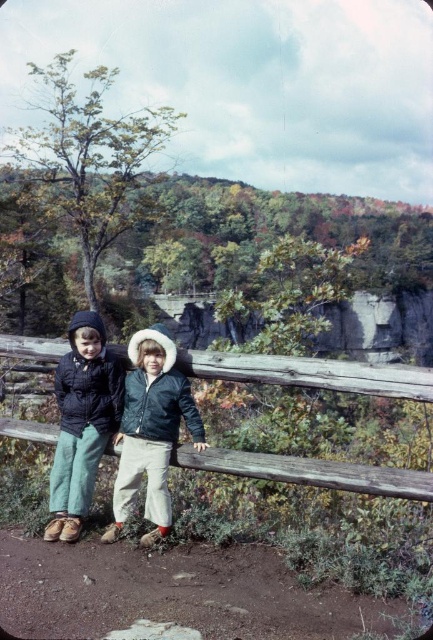
Question: Which of these objects is positioned farthest from the wooden fence at center?

Choices:
 (A) matte black jacket at left
 (B) velvet blue jacket at center

Answer: (A)

Question: Considering the relative positions of wooden fence at center and velvet blue jacket at center in the image provided, where is wooden fence at center located with respect to velvet blue jacket at center?

Choices:
 (A) below
 (B) above

Answer: (B)

Question: Does velvet blue jacket at center have a smaller size compared to matte black jacket at left?

Choices:
 (A) no
 (B) yes

Answer: (B)

Question: Observing the image, what is the correct spatial positioning of velvet blue jacket at center in reference to matte black jacket at left?

Choices:
 (A) left
 (B) right

Answer: (B)

Question: Which of these objects is positioned farthest from the matte black jacket at left?

Choices:
 (A) wooden fence at center
 (B) velvet blue jacket at center

Answer: (A)

Question: Which of the following is the farthest from the observer?

Choices:
 (A) pos(103,404)
 (B) pos(161,502)

Answer: (A)